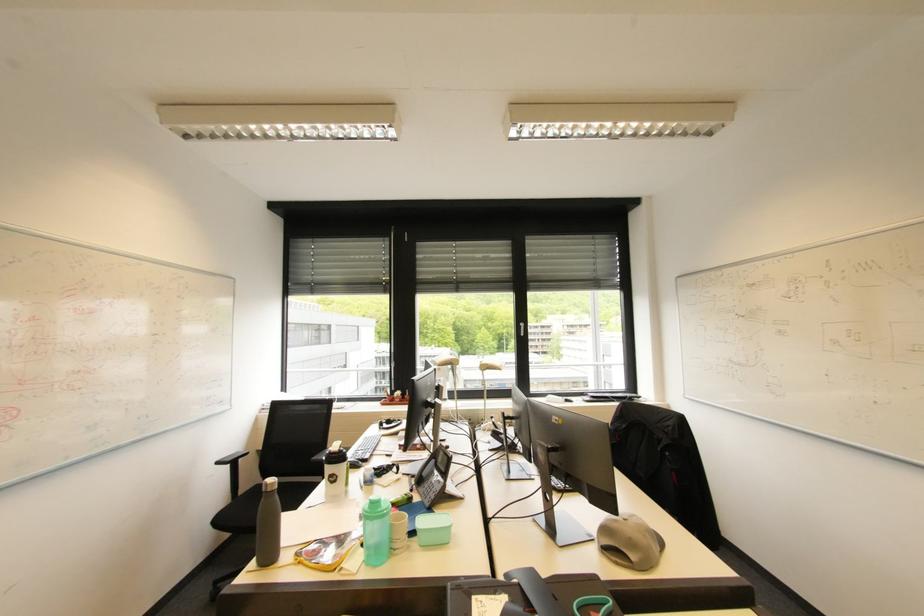
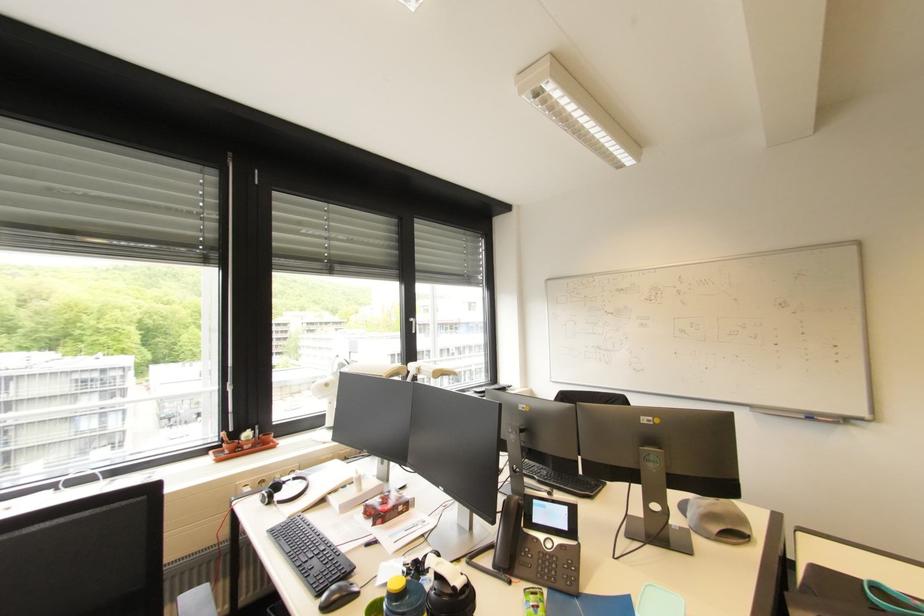
Find the pixel in the second image that matches [390,427] in the first image.

(283, 498)